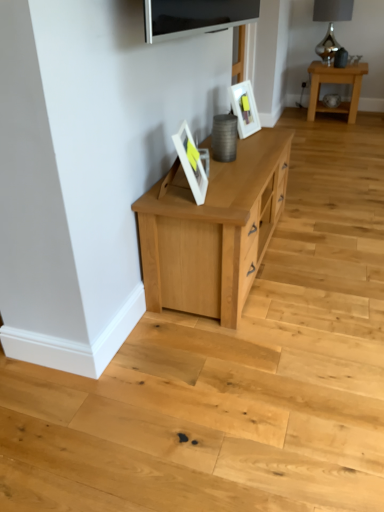
Question: From a real-world perspective, is white glossy picture frame at upper center, positioned as the first picture frame in top-to-bottom order, positioned over satin silver lamp at upper right based on gravity?

Choices:
 (A) yes
 (B) no

Answer: (B)

Question: From a real-world perspective, is white glossy picture frame at upper center, the 2th picture frame positioned from the bottom, below satin silver lamp at upper right?

Choices:
 (A) yes
 (B) no

Answer: (A)

Question: Is white glossy picture frame at upper center, the second picture frame in the left-to-right sequence, not within satin silver lamp at upper right?

Choices:
 (A) no
 (B) yes

Answer: (B)

Question: Is white glossy picture frame at upper center, the 2th picture frame positioned from the bottom, wider than satin silver lamp at upper right?

Choices:
 (A) no
 (B) yes

Answer: (A)

Question: Is white glossy picture frame at upper center, which appears as the 2th picture frame when viewed from the front, looking in the opposite direction of satin silver lamp at upper right?

Choices:
 (A) yes
 (B) no

Answer: (B)

Question: Is white glossy picture frame at upper center, the second picture frame in the left-to-right sequence, positioned before satin silver lamp at upper right?

Choices:
 (A) no
 (B) yes

Answer: (B)

Question: Can you confirm if matte white picture frame at center, the 1th picture frame viewed from the left, is positioned to the left of white glossy picture frame at upper center, the 2th picture frame positioned from the bottom?

Choices:
 (A) no
 (B) yes

Answer: (B)

Question: Is matte white picture frame at center, which is counted as the first picture frame, starting from the front, shorter than white glossy picture frame at upper center, the second picture frame in the left-to-right sequence?

Choices:
 (A) no
 (B) yes

Answer: (B)

Question: Is matte white picture frame at center, positioned as the 2th picture frame in right-to-left order, to the right of white glossy picture frame at upper center, positioned as the first picture frame in top-to-bottom order, from the viewer's perspective?

Choices:
 (A) yes
 (B) no

Answer: (B)

Question: Is matte white picture frame at center, which is counted as the first picture frame, starting from the front, positioned before white glossy picture frame at upper center, which appears as the 2th picture frame when viewed from the front?

Choices:
 (A) no
 (B) yes

Answer: (B)

Question: Considering the relative sizes of matte white picture frame at center, positioned as the 2th picture frame in right-to-left order, and white glossy picture frame at upper center, which appears as the 2th picture frame when viewed from the front, in the image provided, is matte white picture frame at center, positioned as the 2th picture frame in right-to-left order, thinner than white glossy picture frame at upper center, which appears as the 2th picture frame when viewed from the front,?

Choices:
 (A) no
 (B) yes

Answer: (B)

Question: From the image's perspective, is matte white picture frame at center, which is counted as the first picture frame, starting from the front, beneath white glossy picture frame at upper center, which appears as the 2th picture frame when viewed from the front?

Choices:
 (A) no
 (B) yes

Answer: (B)

Question: Can you see matte white picture frame at center, the 1th picture frame viewed from the left, touching satin silver lamp at upper right?

Choices:
 (A) yes
 (B) no

Answer: (B)